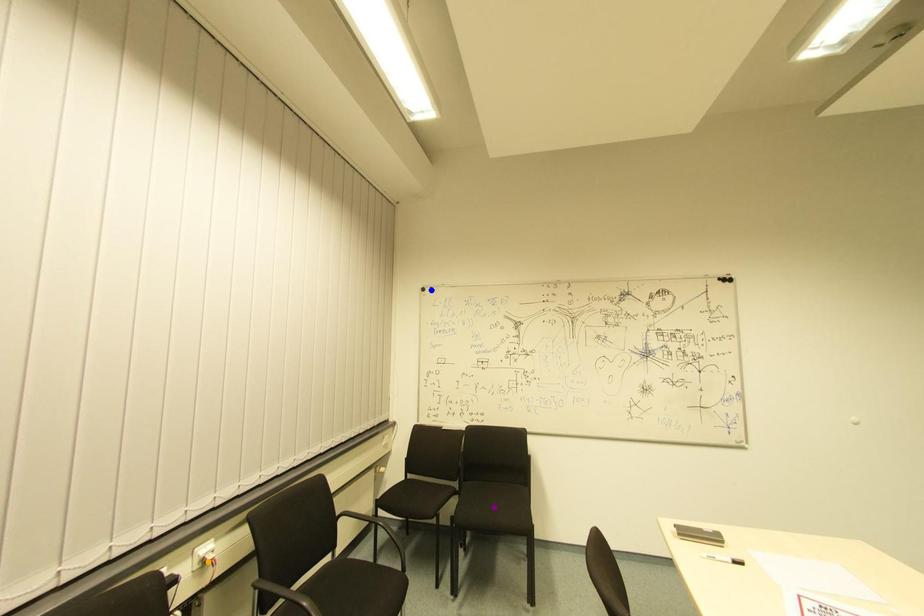
From the picture: Order these from nearest to farthest:
blue point | orange point | purple point

orange point < purple point < blue point